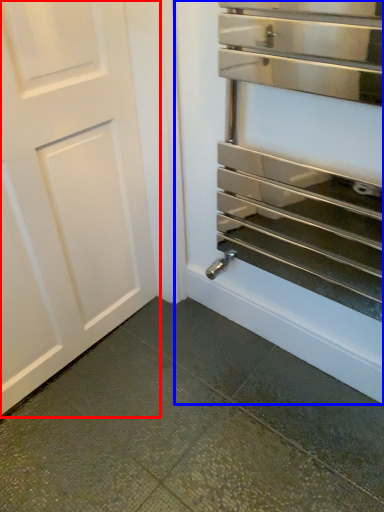
Question: Which object appears farthest to the camera in this image, door (highlighted by a red box) or oven (highlighted by a blue box)?

Choices:
 (A) door
 (B) oven

Answer: (A)